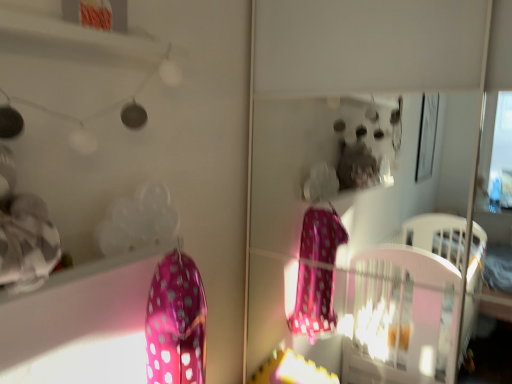
Describe the element at coordinates (176, 322) in the screenshot. The image size is (512, 384). I see `pink shiny polka dot dress at center` at that location.

In order to face pink shiny polka dot dress at center, should I rotate leftwards or rightwards?

Rotate your view left by about 9.968°.

You are a GUI agent. You are given a task and a screenshot of the screen. Output one action in this format:
    pyautogui.click(x=<x>, y=<y>)
    Task: Click on the pink shiny polka dot dress at center
    Image resolution: width=512 pixels, height=384 pixels.
    Given the screenshot: What is the action you would take?
    pyautogui.click(x=176, y=322)

Identify the location of pink shiny polka dot dress at center. Image resolution: width=512 pixels, height=384 pixels. (176, 322).